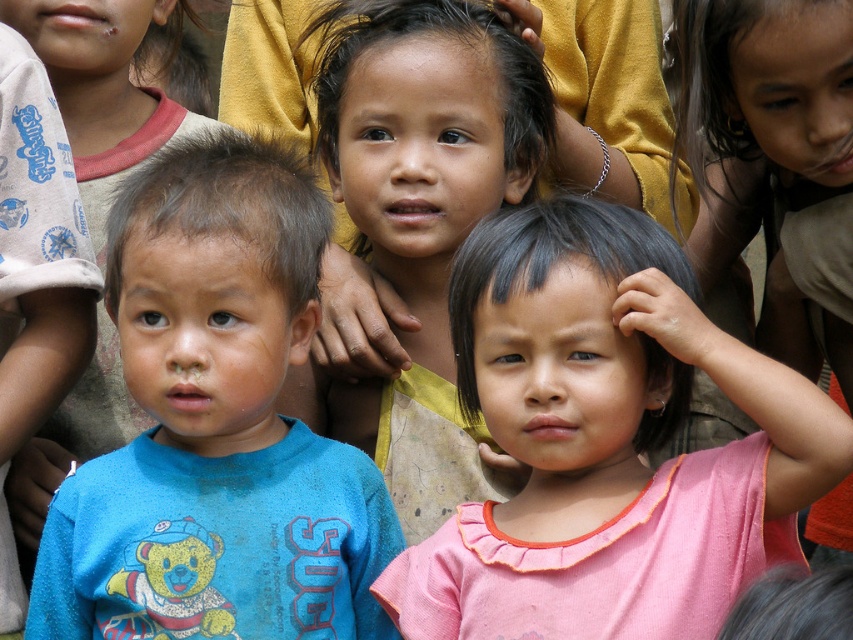
Question: Based on their relative distances, which object is nearer to the pink fabric shirt at center?

Choices:
 (A) matte yellow shirt at center
 (B) blue cotton shirt at left

Answer: (B)

Question: Does pink fabric shirt at center have a larger size compared to blue cotton shirt at left?

Choices:
 (A) yes
 (B) no

Answer: (B)

Question: Considering the relative positions of pink fabric shirt at center and blue cotton shirt at left in the image provided, where is pink fabric shirt at center located with respect to blue cotton shirt at left?

Choices:
 (A) left
 (B) right

Answer: (B)

Question: Which object is the closest to the blue cotton shirt at left?

Choices:
 (A) pink fabric shirt at center
 (B) matte yellow shirt at center

Answer: (A)

Question: Can you confirm if blue cotton shirt at left is thinner than matte yellow shirt at center?

Choices:
 (A) no
 (B) yes

Answer: (A)

Question: Which object is positioned closest to the blue cotton shirt at left?

Choices:
 (A) pink fabric shirt at center
 (B) matte yellow shirt at center

Answer: (A)